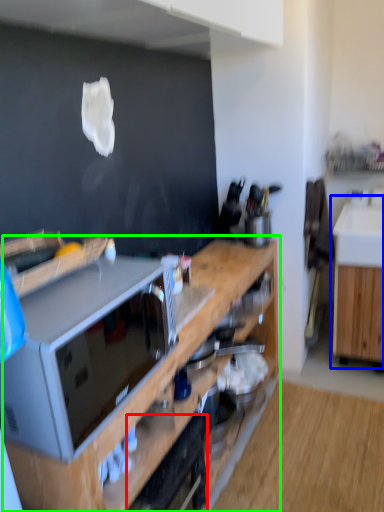
Question: Estimate the real-world distances between objects in this image. Which object is farther from appliance (highlighted by a red box), cabinetry (highlighted by a blue box) or cabinetry (highlighted by a green box)?

Choices:
 (A) cabinetry
 (B) cabinetry

Answer: (A)